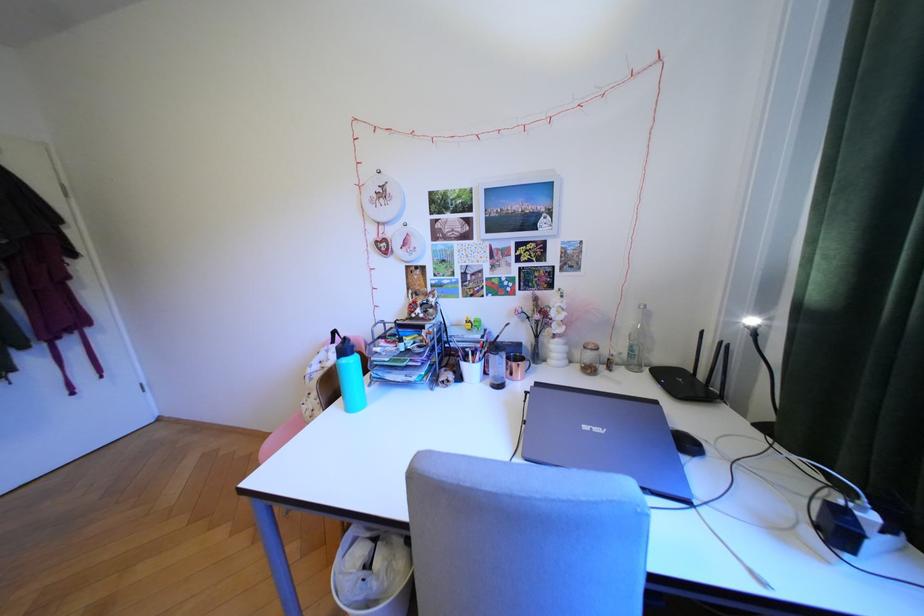
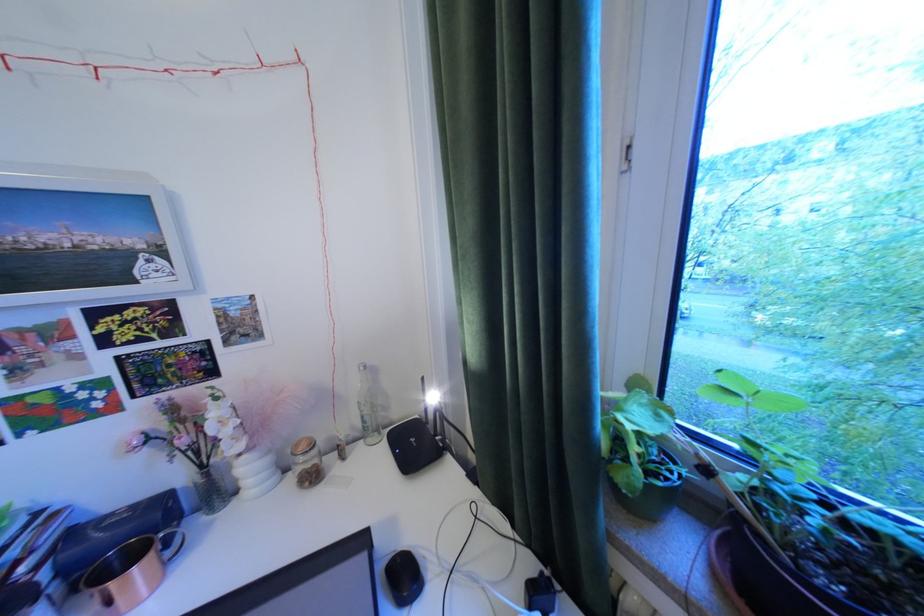
Question: The first image is from the beginning of the video and the second image is from the end. How did the camera likely rotate when shooting the video?

Choices:
 (A) Left
 (B) Right
 (C) Up
 (D) Down

Answer: (B)